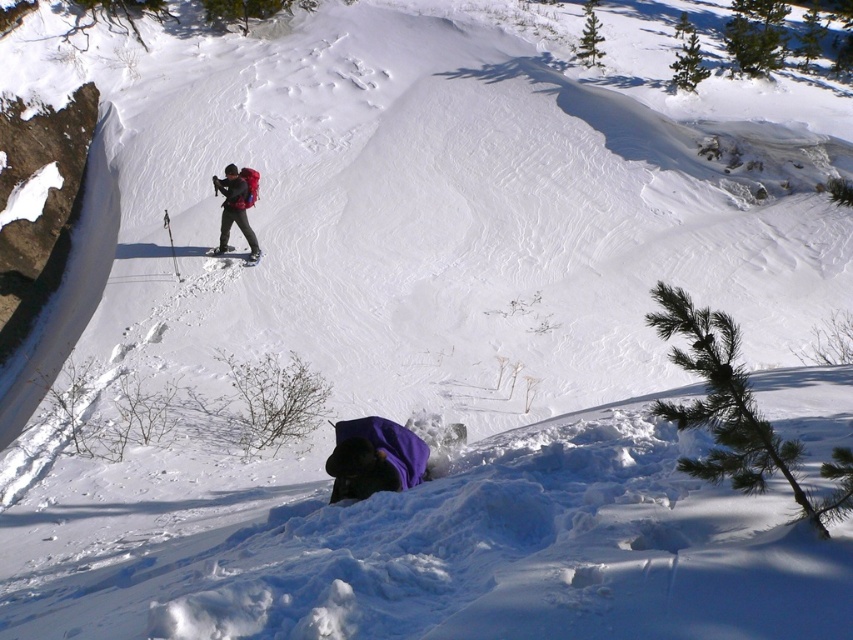
You are a rescue team member trying to locate a person in the snowy area. You see a matte red backpack at center and a matte black ski at center. Which object is taller?

The matte red backpack at center is much taller than the matte black ski at center.